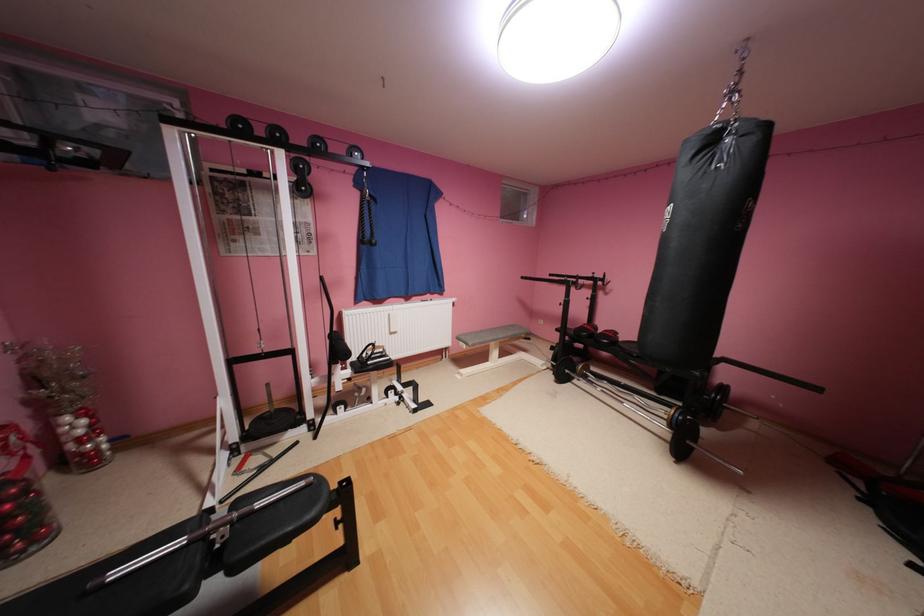
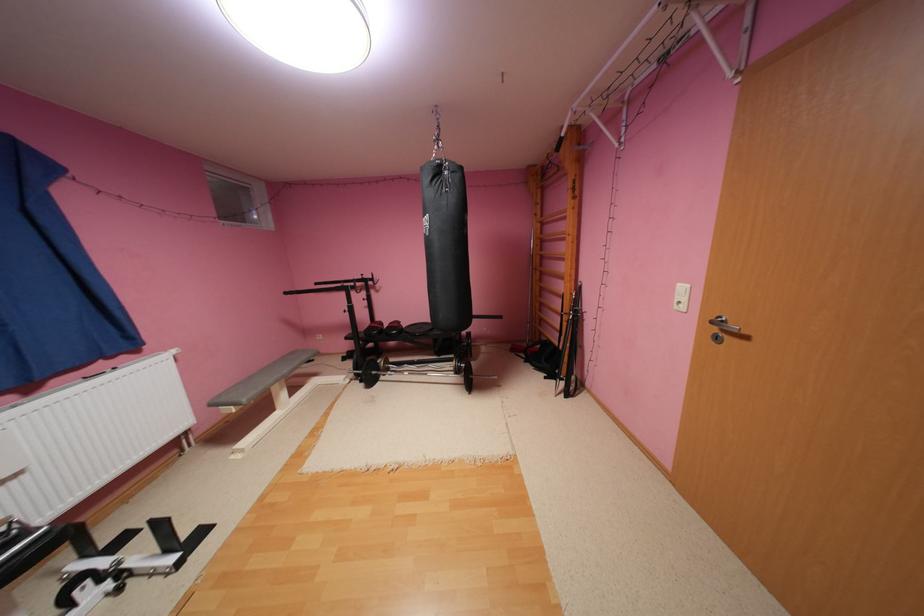
Question: The camera is either moving clockwise (left) or counter-clockwise (right) around the object. The first image is from the beginning of the video and the second image is from the end. Is the camera moving left or right when shooting the video?

Choices:
 (A) Left
 (B) Right

Answer: (A)